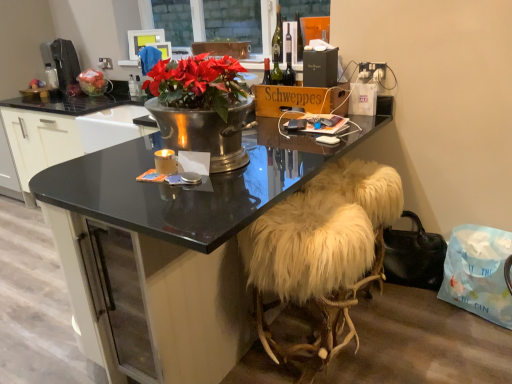
Question: Is clear glass window at upper center turned away from white plastic power outlet at upper center?

Choices:
 (A) yes
 (B) no

Answer: (B)

Question: Are clear glass window at upper center and white plastic power outlet at upper center far apart?

Choices:
 (A) yes
 (B) no

Answer: (A)

Question: Is clear glass window at upper center outside of white plastic power outlet at upper center?

Choices:
 (A) yes
 (B) no

Answer: (A)

Question: Does clear glass window at upper center have a lesser width compared to white plastic power outlet at upper center?

Choices:
 (A) no
 (B) yes

Answer: (A)

Question: From the image's perspective, does clear glass window at upper center appear lower than white plastic power outlet at upper center?

Choices:
 (A) no
 (B) yes

Answer: (A)

Question: Is matte plastic bag of red apples at left situated inside black plastic coffee machine at left or outside?

Choices:
 (A) inside
 (B) outside

Answer: (B)

Question: Looking at the image, does matte plastic bag of red apples at left seem bigger or smaller compared to black plastic coffee machine at left?

Choices:
 (A) small
 (B) big

Answer: (A)

Question: Relative to black plastic coffee machine at left, is matte plastic bag of red apples at left in front or behind?

Choices:
 (A) behind
 (B) front

Answer: (B)

Question: Considering the positions of point (100, 79) and point (61, 66), is point (100, 79) closer or farther from the camera than point (61, 66)?

Choices:
 (A) farther
 (B) closer

Answer: (B)

Question: From a real-world perspective, relative to black leather handbag at lower right, is matte plastic bag of red apples at left vertically above or below?

Choices:
 (A) above
 (B) below

Answer: (A)

Question: Visually, is matte plastic bag of red apples at left positioned to the left or to the right of black leather handbag at lower right?

Choices:
 (A) right
 (B) left

Answer: (B)

Question: Looking at their shapes, would you say matte plastic bag of red apples at left is wider or thinner than black leather handbag at lower right?

Choices:
 (A) thin
 (B) wide

Answer: (A)

Question: Based on their sizes in the image, would you say matte plastic bag of red apples at left is bigger or smaller than black leather handbag at lower right?

Choices:
 (A) big
 (B) small

Answer: (B)

Question: Looking at the image, does white fur stool at lower right seem bigger or smaller compared to metallic silver sink at center?

Choices:
 (A) small
 (B) big

Answer: (B)

Question: From a real-world perspective, relative to metallic silver sink at center, is white fur stool at lower right vertically above or below?

Choices:
 (A) above
 (B) below

Answer: (B)